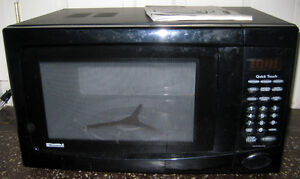
I want to click on floor, so click(7, 135).